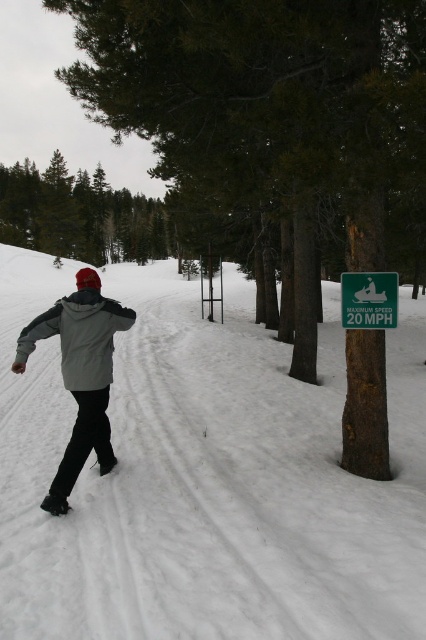
Question: Which point is farther from the camera taking this photo?

Choices:
 (A) (354, 81)
 (B) (63, 298)
 (C) (310, 582)
 (D) (143, 200)

Answer: (D)

Question: Which object appears farthest from the camera in this image?

Choices:
 (A) green matte tree at upper center
 (B) gray matte jacket at center
 (C) gray fleece jacket at center

Answer: (A)

Question: Does green matte tree at upper center appear on the right side of gray fleece jacket at center?

Choices:
 (A) yes
 (B) no

Answer: (B)

Question: Does white powdery snow at center appear under green matte tree at upper center?

Choices:
 (A) yes
 (B) no

Answer: (A)

Question: Does brown rough tree at center appear under gray fleece jacket at center?

Choices:
 (A) no
 (B) yes

Answer: (A)

Question: Which of the following is the farthest from the observer?

Choices:
 (A) (40, 195)
 (B) (207, 221)
 (C) (114, 304)

Answer: (A)